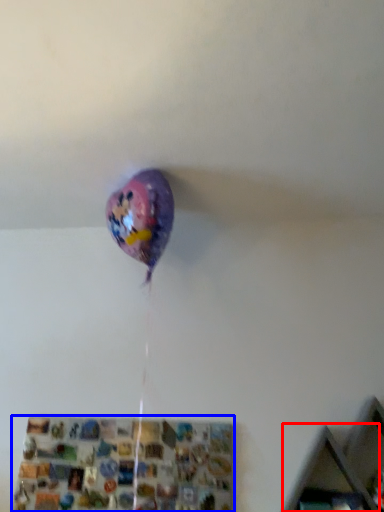
Question: Among these objects, which one is farthest to the camera, shelf (highlighted by a red box) or shelf (highlighted by a blue box)?

Choices:
 (A) shelf
 (B) shelf

Answer: (B)